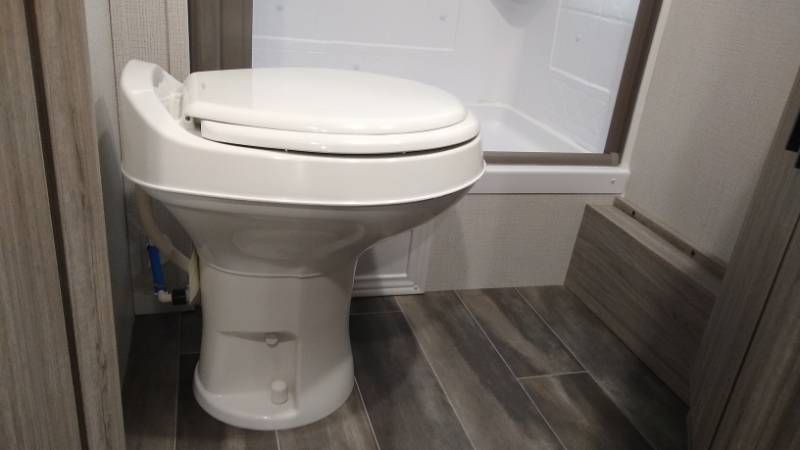
Where is `wall`? Image resolution: width=800 pixels, height=450 pixels. wall is located at coordinates (26, 290).